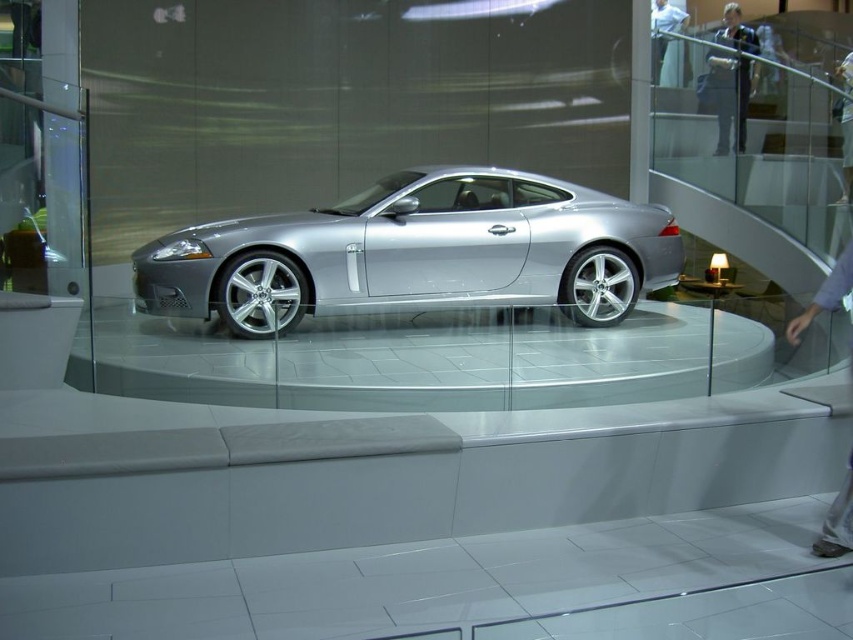
Question: Which point is farther to the camera?

Choices:
 (A) dark blue suit at upper right
 (B) light blue shirt at upper center
 (C) silver metallic car at center

Answer: (B)

Question: Observing the image, what is the correct spatial positioning of silver metallic car at center in reference to dark blue suit at upper right?

Choices:
 (A) below
 (B) above

Answer: (A)

Question: Which of the following is the closest to the observer?

Choices:
 (A) click(665, 51)
 (B) click(737, 4)

Answer: (A)

Question: In this image, where is silver metallic car at center located relative to dark blue suit at upper right?

Choices:
 (A) below
 (B) above

Answer: (A)

Question: Which object is farther from the camera taking this photo?

Choices:
 (A) light blue shirt at upper center
 (B) dark blue suit at upper right
 (C) silver metallic car at center

Answer: (A)

Question: Can you confirm if dark blue suit at upper right is positioned to the right of light blue shirt at upper center?

Choices:
 (A) yes
 (B) no

Answer: (B)